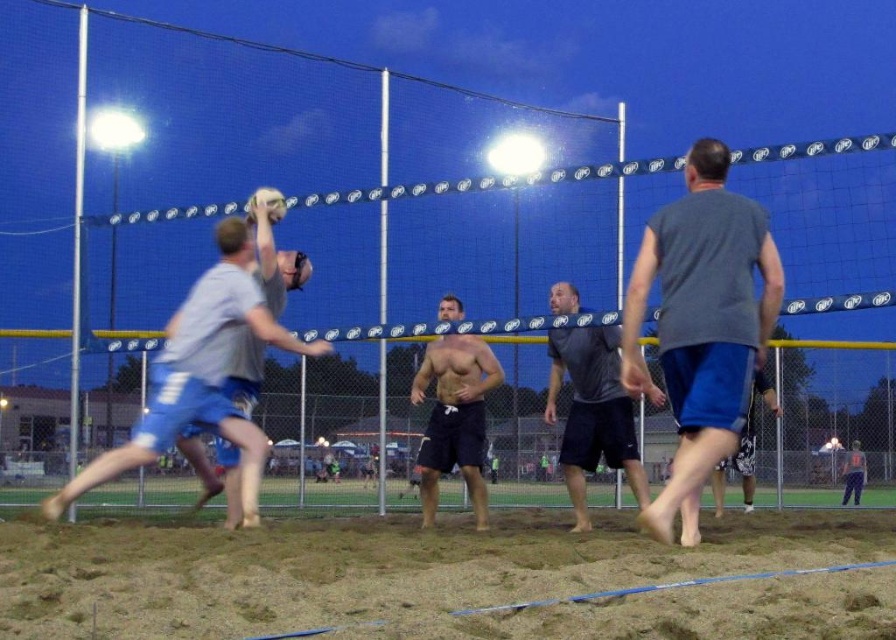
Question: Is gray fabric shirt at left further to camera compared to white matte volleyball at upper center?

Choices:
 (A) yes
 (B) no

Answer: (B)

Question: Is gray matte tank top at right further to the viewer compared to white matte volleyball at upper center?

Choices:
 (A) yes
 (B) no

Answer: (B)

Question: Based on their relative distances, which object is farther from the shiny black shorts at center?

Choices:
 (A) dark blue shorts at lower right
 (B) gray matte shirt at center
 (C) gray matte tank top at right

Answer: (A)

Question: Based on their relative distances, which object is farther from the gray fabric shirt at left?

Choices:
 (A) gray matte shirt at center
 (B) shiny black shorts at center
 (C) blue shorts at right

Answer: (C)

Question: Which point is farther to the camera?

Choices:
 (A) (272, 202)
 (B) (858, 500)
 (C) (744, 504)
 (D) (584, 598)

Answer: (B)

Question: Does brown sandy beach at lower center appear over white matte volleyball at upper center?

Choices:
 (A) no
 (B) yes

Answer: (A)